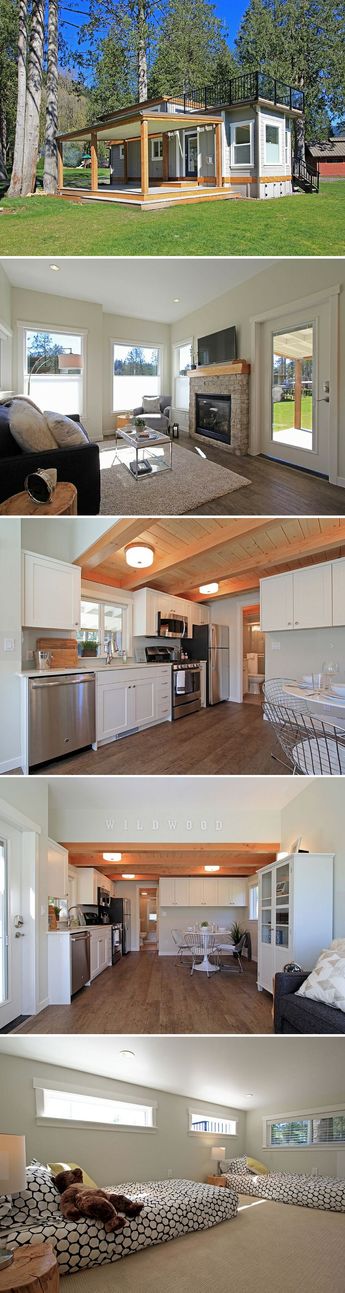
The width and height of the screenshot is (345, 1293). I want to click on chairs, so click(x=196, y=948), click(x=178, y=932), click(x=234, y=939), click(x=312, y=732), click(x=281, y=694), click(x=156, y=414).